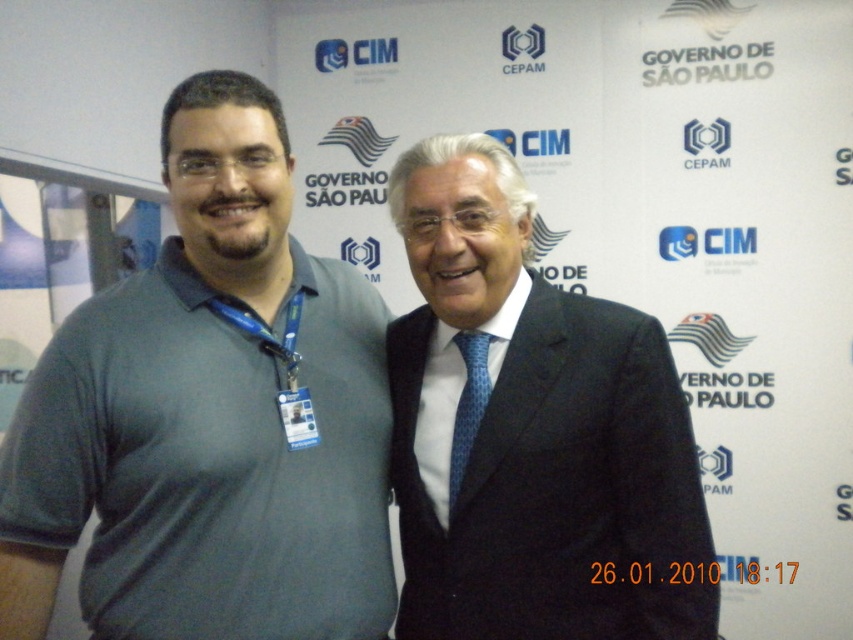
Question: Which point is closer to the camera taking this photo?

Choices:
 (A) (401, 467)
 (B) (74, 324)

Answer: (B)

Question: Does dark gray suit at center lie in front of blue dotted tie at center?

Choices:
 (A) no
 (B) yes

Answer: (B)

Question: Which point is farther from the camera taking this photo?

Choices:
 (A) (608, 458)
 (B) (372, 630)
 (C) (486, 390)

Answer: (C)

Question: Considering the real-world distances, which object is farthest from the dark gray suit at center?

Choices:
 (A) blue dotted tie at center
 (B) gray cotton polo shirt at left

Answer: (B)

Question: Where is gray cotton polo shirt at left located in relation to dark gray suit at center in the image?

Choices:
 (A) left
 (B) right

Answer: (A)

Question: Does dark gray suit at center appear on the left side of blue dotted tie at center?

Choices:
 (A) yes
 (B) no

Answer: (B)